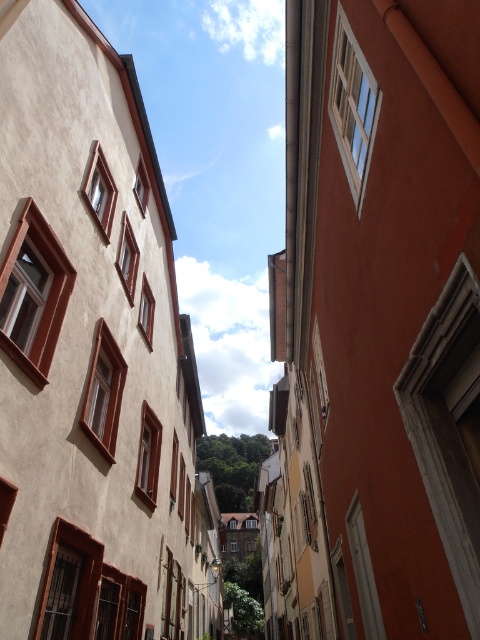
Question: Is smooth orange wall at right thinner than smooth beige building at left?

Choices:
 (A) yes
 (B) no

Answer: (B)

Question: Does smooth orange wall at right come in front of smooth beige building at left?

Choices:
 (A) no
 (B) yes

Answer: (B)

Question: From the image, what is the correct spatial relationship of smooth orange wall at right in relation to smooth beige building at left?

Choices:
 (A) left
 (B) right

Answer: (B)

Question: Which of the following is the farthest from the observer?

Choices:
 (A) smooth orange wall at right
 (B) smooth beige building at left

Answer: (B)